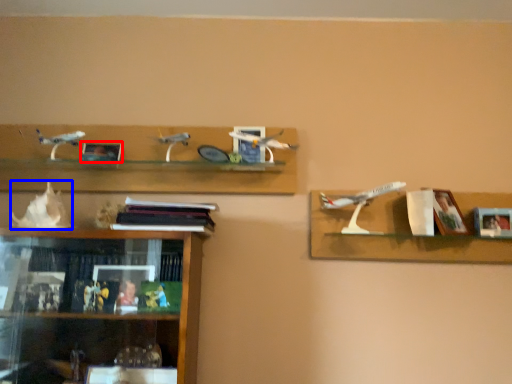
Question: Which of the following is the closest to the observer, picture frame (highlighted by a red box) or toy (highlighted by a blue box)?

Choices:
 (A) picture frame
 (B) toy

Answer: (B)